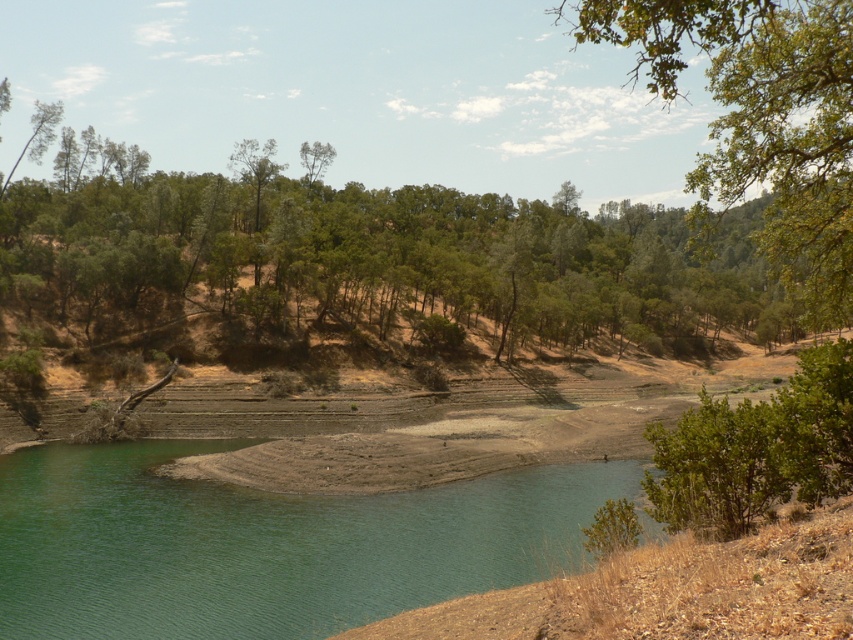
Who is taller, green smooth water at lower left or green leafy tree at upper right?

green leafy tree at upper right is taller.

Is green smooth water at lower left bigger than green leafy tree at upper right?

Incorrect, green smooth water at lower left is not larger than green leafy tree at upper right.

The width and height of the screenshot is (853, 640). Identify the location of green smooth water at lower left. (265, 544).

Which is below, green leafy tree at upper center or green leafy tree at upper right?

green leafy tree at upper center is below.

Does green leafy tree at upper center have a larger size compared to green leafy tree at upper right?

Correct, green leafy tree at upper center is larger in size than green leafy tree at upper right.

Image resolution: width=853 pixels, height=640 pixels. Describe the element at coordinates (403, 253) in the screenshot. I see `green leafy tree at upper center` at that location.

Find the location of a particular element. The width and height of the screenshot is (853, 640). green leafy tree at upper center is located at coordinates (403, 253).

Does green leafy tree at upper center have a lesser height compared to green smooth water at lower left?

In fact, green leafy tree at upper center may be taller than green smooth water at lower left.

Does green leafy tree at upper center have a smaller size compared to green smooth water at lower left?

No, green leafy tree at upper center is not smaller than green smooth water at lower left.

Is point (271, 221) behind point (109, 461)?

Yes, point (271, 221) is farther from viewer.

The height and width of the screenshot is (640, 853). I want to click on green leafy tree at upper center, so click(x=403, y=253).